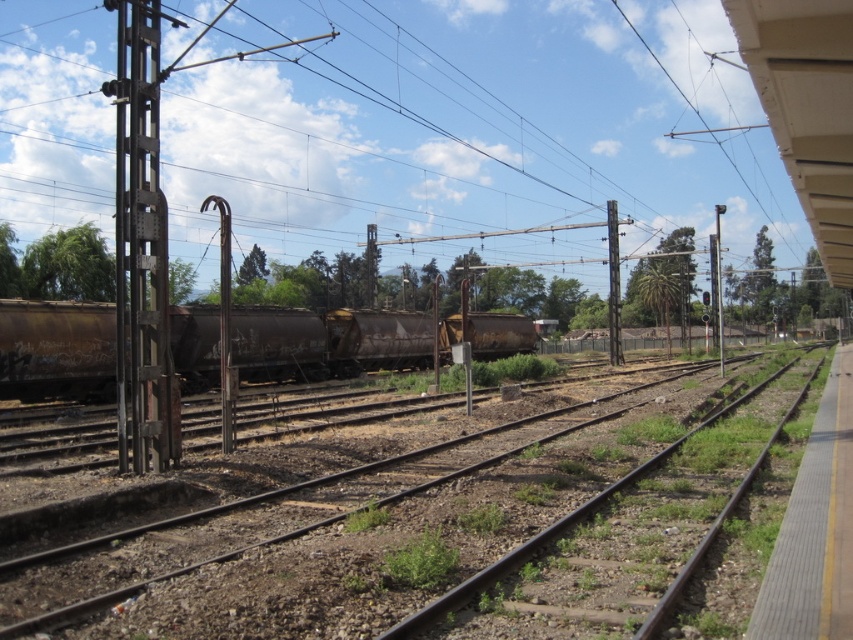
Question: Is the position of rusty metal train car at center less distant than that of metallic pole at right?

Choices:
 (A) yes
 (B) no

Answer: (A)

Question: Which of the following is the closest to the observer?

Choices:
 (A) (125, 65)
 (B) (718, 218)

Answer: (A)

Question: Is metallic power line at left thinner than green grassy train track at center?

Choices:
 (A) no
 (B) yes

Answer: (A)

Question: Estimate the real-world distances between objects in this image. Which object is closer to the metallic pole at right?

Choices:
 (A) metallic pole at center
 (B) metallic power line at left
 (C) rusty metal train car at center
 (D) green grassy train track at center

Answer: (A)

Question: In this image, where is metallic gray pole at left located relative to metallic pole at center?

Choices:
 (A) right
 (B) left

Answer: (B)

Question: Which point is farther to the camera?

Choices:
 (A) tap(618, 225)
 (B) tap(453, 36)
 (C) tap(143, 364)

Answer: (B)